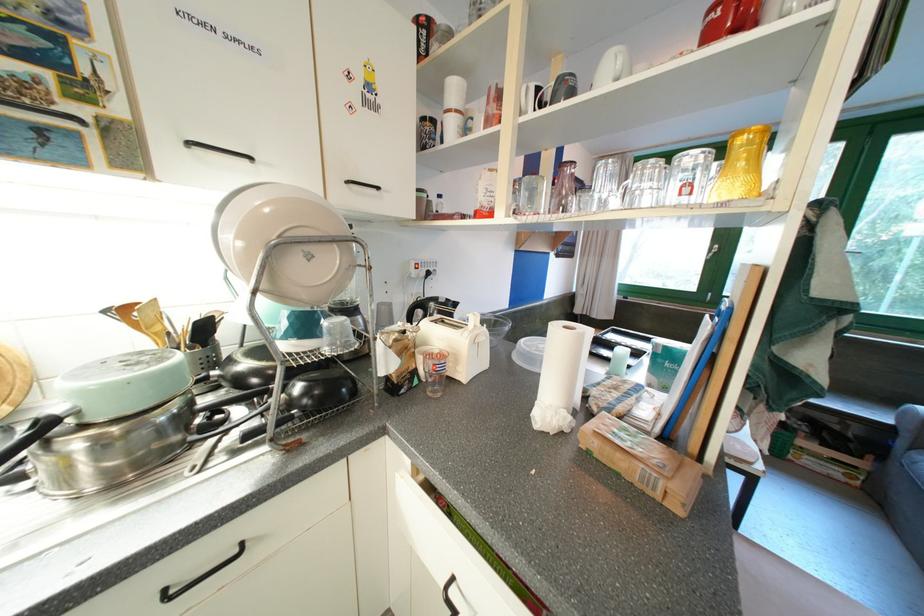
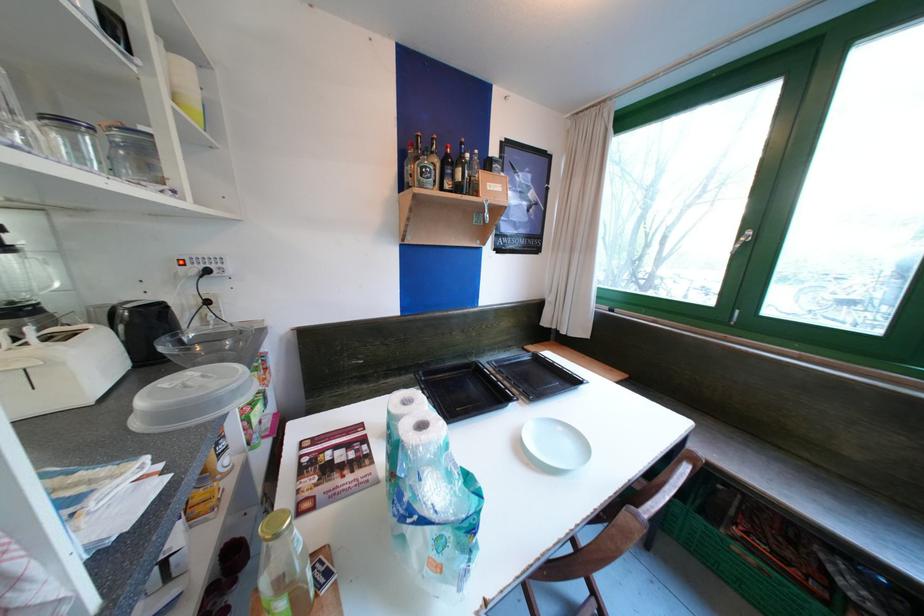
What movement of the cameraman would produce the second image?

The cameraman walked toward right, forward.